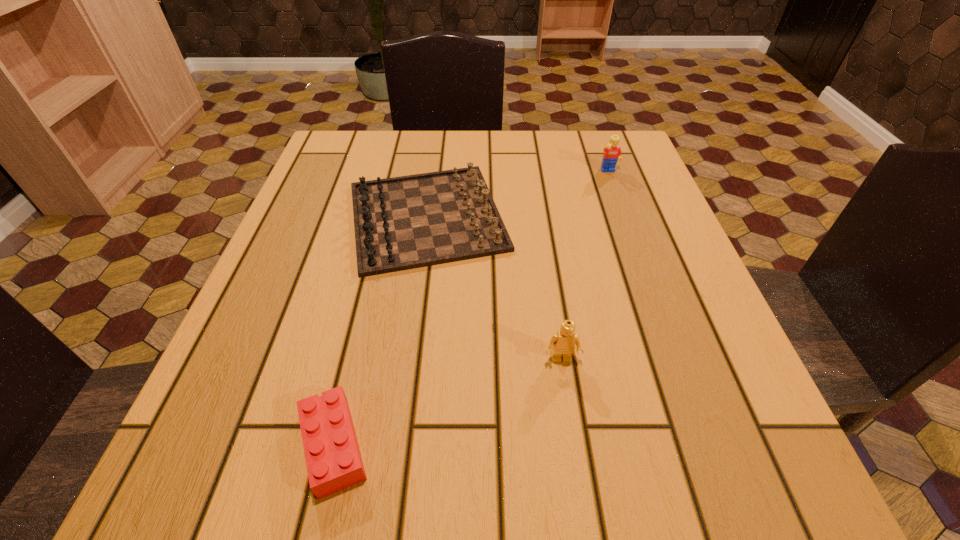
This screenshot has height=540, width=960. What are the coordinates of `empty location between the rightmost Lego and the shortest Lego` in the screenshot? It's located at (471, 309).

The height and width of the screenshot is (540, 960). What are the coordinates of `empty location between the rightmost object and the second nearest object` in the screenshot? It's located at (586, 266).

Find the location of a particular element. This screenshot has height=540, width=960. free space between the rightmost object and the chessboard is located at coordinates (517, 194).

Where is `free area in between the second shortest object and the third object from left to right`? free area in between the second shortest object and the third object from left to right is located at coordinates (494, 288).

I want to click on blank region between the second farthest Lego and the shortest object, so click(447, 402).

Locate an element on the screen. The width and height of the screenshot is (960, 540). empty space that is in between the third object from left to right and the leftmost Lego is located at coordinates point(447,402).

Point out which object is positioned as the nearest to the leftmost Lego. Please provide its 2D coordinates. Your answer should be formatted as a tuple, i.e. [(x, y)], where the tuple contains the x and y coordinates of a point satisfying the conditions above.

[(407, 222)]

Point out which object is positioned as the nearest to the farthest Lego. Please provide its 2D coordinates. Your answer should be formatted as a tuple, i.e. [(x, y)], where the tuple contains the x and y coordinates of a point satisfying the conditions above.

[(407, 222)]

Select which Lego appears as the closest to the rightmost object. Please provide its 2D coordinates. Your answer should be formatted as a tuple, i.e. [(x, y)], where the tuple contains the x and y coordinates of a point satisfying the conditions above.

[(562, 343)]

Select which Lego appears as the second closest to the third tallest object. Please provide its 2D coordinates. Your answer should be formatted as a tuple, i.e. [(x, y)], where the tuple contains the x and y coordinates of a point satisfying the conditions above.

[(612, 152)]